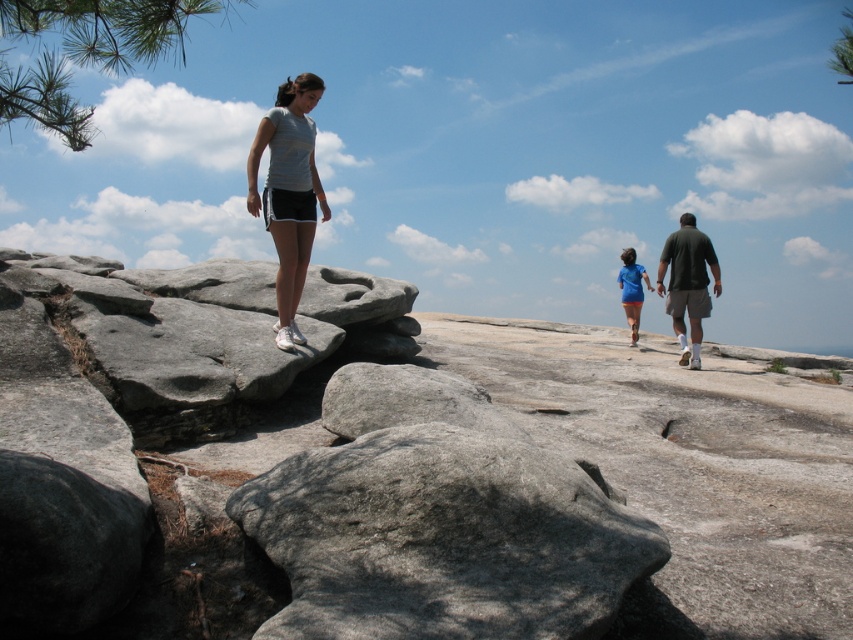
Does gray rock at upper left come in front of gray rough rock at center?

No, gray rock at upper left is further to the viewer.

Between gray rock at upper left and gray rough rock at center, which one appears on the right side from the viewer's perspective?

Positioned to the right is gray rough rock at center.

Locate an element on the screen. The image size is (853, 640). gray rock at upper left is located at coordinates tap(669, 481).

In the scene shown: Does gray rough rock at center appear over dark green fabric shirt at right?

Actually, gray rough rock at center is below dark green fabric shirt at right.

Image resolution: width=853 pixels, height=640 pixels. What are the coordinates of `gray rough rock at center` in the screenshot? It's located at (444, 538).

Does light gray t-shirt at center have a larger size compared to dark green fabric shirt at right?

Incorrect, light gray t-shirt at center is not larger than dark green fabric shirt at right.

Does point (294, 220) come in front of point (699, 248)?

Yes, point (294, 220) is closer to viewer.

This screenshot has width=853, height=640. I want to click on light gray t-shirt at center, so click(x=288, y=193).